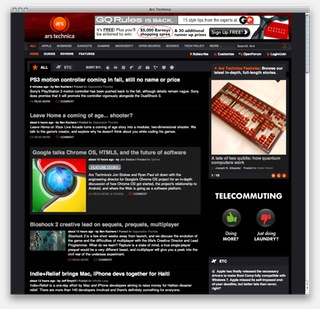
Image resolution: width=320 pixels, height=309 pixels. In order to click on abacus in this screenshot , I will do `click(231, 113)`.